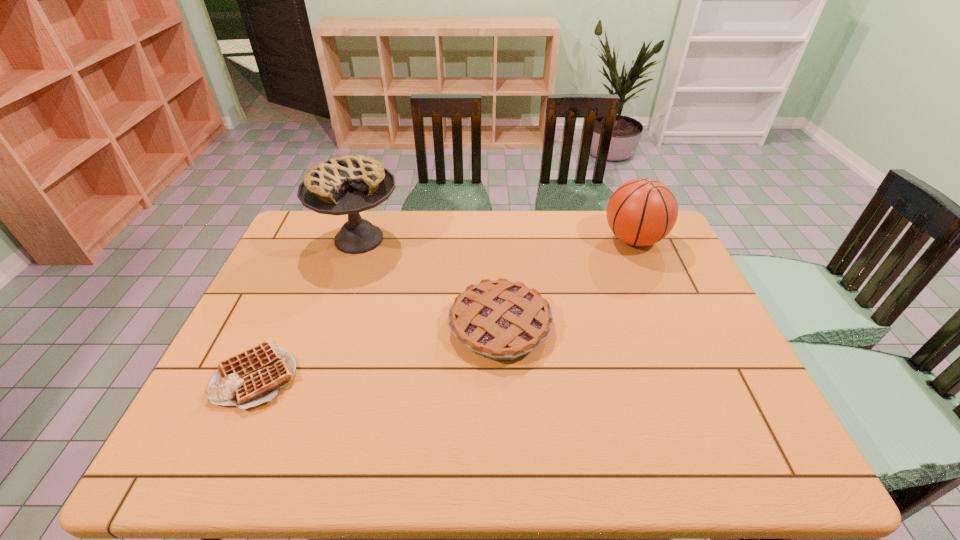
Locate an element on the screen. The height and width of the screenshot is (540, 960). free spot between the waffle and the rightmost object is located at coordinates (445, 307).

Identify the location of free space between the rightmost object and the waffle. (445, 307).

Where is `free spot between the basketball and the left pie`? free spot between the basketball and the left pie is located at coordinates (496, 239).

Find the location of a particular element. This screenshot has width=960, height=540. free space between the second object from right to left and the farther pie is located at coordinates (429, 282).

Select which object is the second closest to the second shortest object. Please provide its 2D coordinates. Your answer should be formatted as a tuple, i.e. [(x, y)], where the tuple contains the x and y coordinates of a point satisfying the conditions above.

[(641, 212)]

At what (x,y) coordinates should I click in order to perform the action: click on the second closest object to the rightmost object. Please return your answer as a coordinate pair (x, y). Looking at the image, I should click on (351, 184).

What are the coordinates of `vacant position in the image that satisfies the following two spatial constraints: 1. on the cut side of the second tallest object; 2. on the left side of the taller pie` in the screenshot? It's located at (359, 240).

I want to click on blank space that satisfies the following two spatial constraints: 1. on the back side of the nearer pie; 2. on the right side of the waffle, so click(x=279, y=326).

This screenshot has width=960, height=540. In order to click on vacant position in the image that satisfies the following two spatial constraints: 1. on the back side of the right pie; 2. on the left side of the shortest object in this screenshot , I will do `click(279, 326)`.